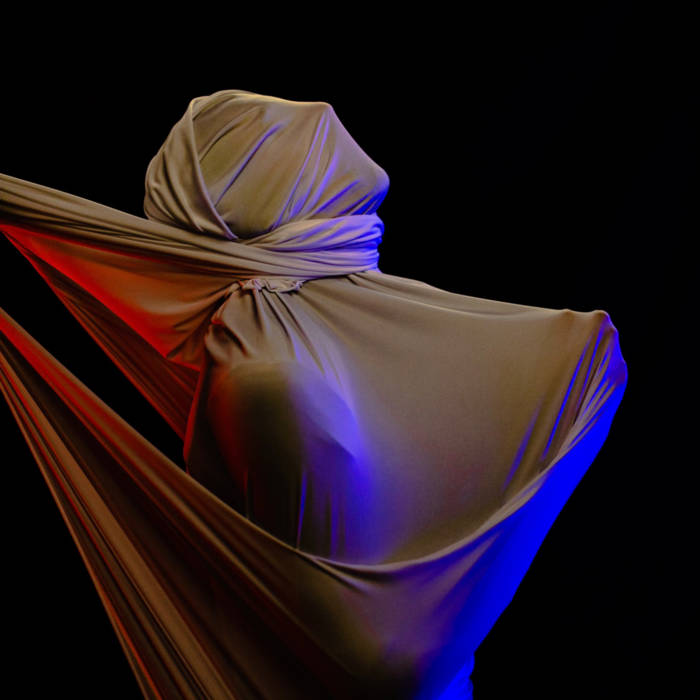
At what (x,y) coordinates should I click in order to perform the action: click on fabric. Please return your answer as a coordinate pair (x, y). This screenshot has height=700, width=700. Looking at the image, I should click on (337, 246).